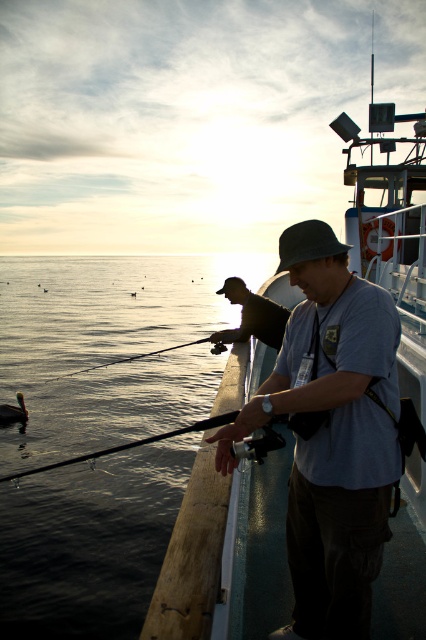
Between dark blue water at lower left and shiny metallic rod at center, which one is positioned lower?

shiny metallic rod at center

Describe the element at coordinates (109, 348) in the screenshot. I see `dark blue water at lower left` at that location.

At what (x,y) coordinates should I click in order to perform the action: click on dark blue water at lower left. Please return your answer as a coordinate pair (x, y). This screenshot has width=426, height=640. Looking at the image, I should click on (109, 348).

Can you confirm if dark blue water at lower left is positioned above matte black fishing rod at center?

Yes, dark blue water at lower left is above matte black fishing rod at center.

Does point (60, 506) lie in front of point (229, 339)?

No.

What are the coordinates of `dark blue water at lower left` in the screenshot? It's located at (109, 348).

In the scene shown: Does white wood boat at center have a greater height compared to matte black fishing rod at center?

Yes.

Is white wood boat at center below matte black fishing rod at center?

No, white wood boat at center is not below matte black fishing rod at center.

In the scene shown: Who is more forward, (187, 531) or (275, 332)?

Point (187, 531)

What are the coordinates of `white wood boat at center` in the screenshot? It's located at (199, 563).